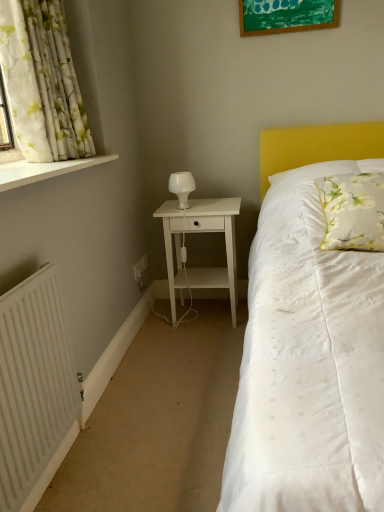
Question: From a real-world perspective, does green matte picture frame at upper center stand above white glossy window sill at upper left?

Choices:
 (A) no
 (B) yes

Answer: (B)

Question: Can you confirm if green matte picture frame at upper center is thinner than white glossy window sill at upper left?

Choices:
 (A) yes
 (B) no

Answer: (A)

Question: From the image's perspective, does green matte picture frame at upper center appear lower than white glossy window sill at upper left?

Choices:
 (A) yes
 (B) no

Answer: (B)

Question: From a real-world perspective, is green matte picture frame at upper center physically below white glossy window sill at upper left?

Choices:
 (A) yes
 (B) no

Answer: (B)

Question: Is green matte picture frame at upper center directly adjacent to white glossy window sill at upper left?

Choices:
 (A) no
 (B) yes

Answer: (A)

Question: Can we say green matte picture frame at upper center lies outside white glossy window sill at upper left?

Choices:
 (A) no
 (B) yes

Answer: (B)

Question: From the image's perspective, is green matte picture frame at upper center beneath white ribbed radiator at lower left?

Choices:
 (A) no
 (B) yes

Answer: (A)

Question: Does green matte picture frame at upper center come in front of white ribbed radiator at lower left?

Choices:
 (A) yes
 (B) no

Answer: (B)

Question: Could you tell me if green matte picture frame at upper center is facing white ribbed radiator at lower left?

Choices:
 (A) no
 (B) yes

Answer: (A)

Question: Is green matte picture frame at upper center turned away from white ribbed radiator at lower left?

Choices:
 (A) yes
 (B) no

Answer: (B)

Question: Is green matte picture frame at upper center completely or partially outside of white ribbed radiator at lower left?

Choices:
 (A) no
 (B) yes

Answer: (B)

Question: Can you confirm if green matte picture frame at upper center is positioned to the right of white ribbed radiator at lower left?

Choices:
 (A) yes
 (B) no

Answer: (A)

Question: Is white matte nightstand at center not inside white glossy window sill at upper left?

Choices:
 (A) yes
 (B) no

Answer: (A)